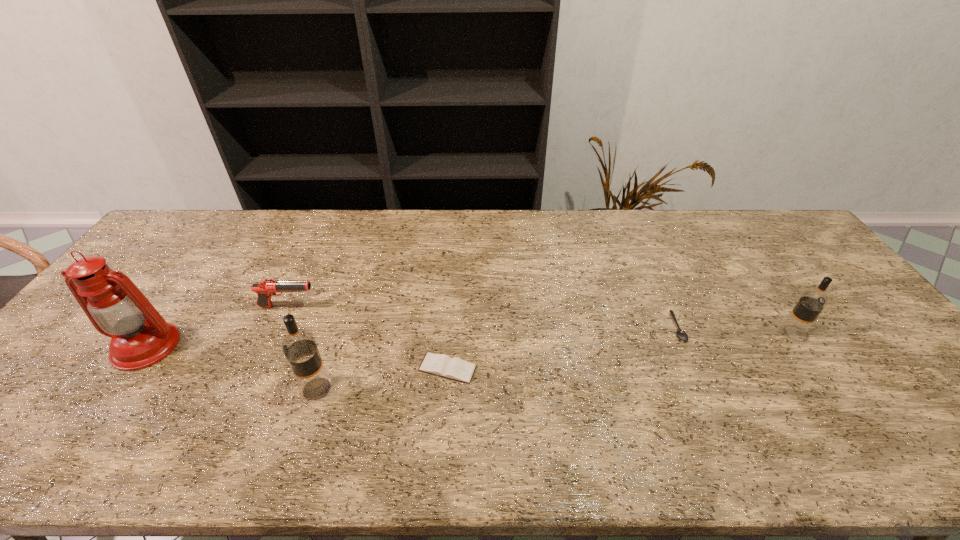
Image resolution: width=960 pixels, height=540 pixels. In order to click on vacant space that is in between the second tallest object and the tallest object in this screenshot , I will do `click(231, 368)`.

Locate an element on the screen. free spot between the shorter vodka and the farthest object is located at coordinates (540, 320).

Locate an element on the screen. empty space that is in between the third object from left to right and the oil lamp is located at coordinates (231, 368).

Find the location of a particular element. The image size is (960, 540). free area in between the farthest object and the right vodka is located at coordinates (540, 320).

You are a GUI agent. You are given a task and a screenshot of the screen. Output one action in this format:
    pyautogui.click(x=<x>, y=<y>)
    Task: Click on the free spot between the third shortest object and the shortest object
    The height and width of the screenshot is (540, 960).
    Given the screenshot: What is the action you would take?
    pyautogui.click(x=483, y=317)

Identify which object is located as the nearest to the tallest object. Please provide its 2D coordinates. Your answer should be formatted as a tuple, i.e. [(x, y)], where the tuple contains the x and y coordinates of a point satisfying the conditions above.

[(266, 288)]

At what (x,y) coordinates should I click in order to perform the action: click on object that is the fifth closest to the shortest object. Please return your answer as a coordinate pair (x, y). The width and height of the screenshot is (960, 540). Looking at the image, I should click on (140, 337).

You are a GUI agent. You are given a task and a screenshot of the screen. Output one action in this format:
    pyautogui.click(x=<x>, y=<y>)
    Task: Click on the vacant space that satisfies the following two spatial constraints: 1. on the label of the right vodka; 2. on the front side of the leftmost object
    The image size is (960, 540).
    Given the screenshot: What is the action you would take?
    pyautogui.click(x=800, y=346)

What are the coordinates of `blank area in the image that satisfies the following two spatial constraints: 1. at the aiming end of the fourth tallest object; 2. on the right side of the fourth object from left to right` in the screenshot? It's located at click(260, 368).